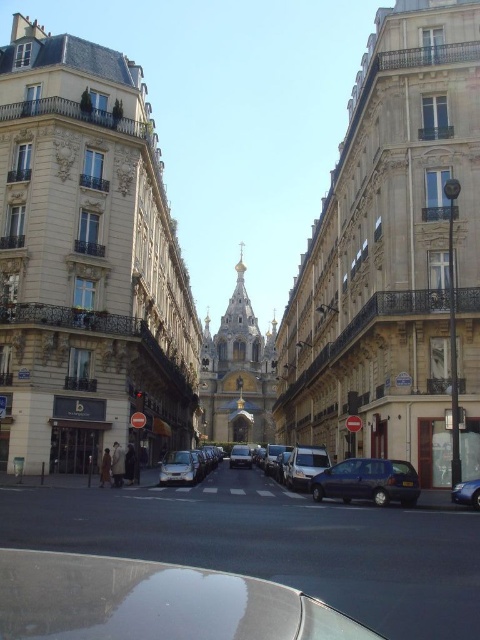
Based on the photo, is metallic blue car at center below silver metallic van at center?

Incorrect, metallic blue car at center is not positioned below silver metallic van at center.

Find the location of `metallic blue car at center`. metallic blue car at center is located at coordinates (467, 493).

Does point (348, 477) come in front of point (300, 461)?

Yes, it is.

Does dark blue metallic car at center have a greater width compared to metallic silver van at center?

Correct, the width of dark blue metallic car at center exceeds that of metallic silver van at center.

You are a GUI agent. You are given a task and a screenshot of the screen. Output one action in this format:
    pyautogui.click(x=<x>, y=<y>)
    Task: Click on the dark blue metallic car at center
    Image resolution: width=480 pixels, height=640 pixels.
    Given the screenshot: What is the action you would take?
    pyautogui.click(x=368, y=481)

This screenshot has width=480, height=640. What are the coordinates of `dark blue metallic car at center` in the screenshot? It's located at (368, 481).

Does metallic silver van at center come behind satin silver car at center?

No, metallic silver van at center is in front of satin silver car at center.

Consider the image. Which is more to the right, metallic silver van at center or satin silver car at center?

From the viewer's perspective, metallic silver van at center appears more on the right side.

Between point (312, 464) and point (171, 458), which one is positioned behind?

Positioned behind is point (171, 458).

Where is `metallic silver van at center`? The height and width of the screenshot is (640, 480). metallic silver van at center is located at coordinates (304, 465).